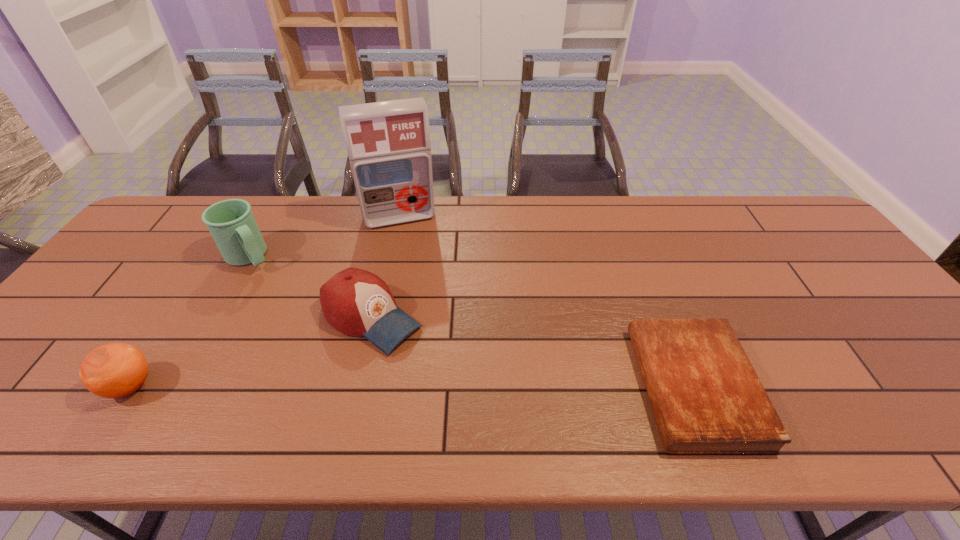
Locate an element on the screen. The width and height of the screenshot is (960, 540). free space located 0.340m on the front-facing side of the farthest object is located at coordinates (429, 308).

The width and height of the screenshot is (960, 540). In order to click on object located in the far edge section of the desktop in this screenshot , I will do `click(388, 143)`.

What are the coordinates of `orange located in the near edge section of the desktop` in the screenshot? It's located at (115, 370).

Locate an element on the screen. Bible situated at the near edge is located at coordinates (706, 397).

In the image, there is a desktop. Identify the location of vacant space at the far edge. The image size is (960, 540). (275, 212).

Locate an element on the screen. The width and height of the screenshot is (960, 540). free space at the near edge is located at coordinates (180, 396).

Identify the location of vacant space at the left edge. The width and height of the screenshot is (960, 540). (102, 307).

This screenshot has width=960, height=540. In the image, there is a desktop. Identify the location of vacant space at the far left corner. (173, 202).

The height and width of the screenshot is (540, 960). In order to click on vacant space at the near left corner of the desktop in this screenshot , I will do `click(38, 391)`.

Find the location of a particular element. The width and height of the screenshot is (960, 540). empty location between the baseball cap and the second tallest object is located at coordinates (310, 287).